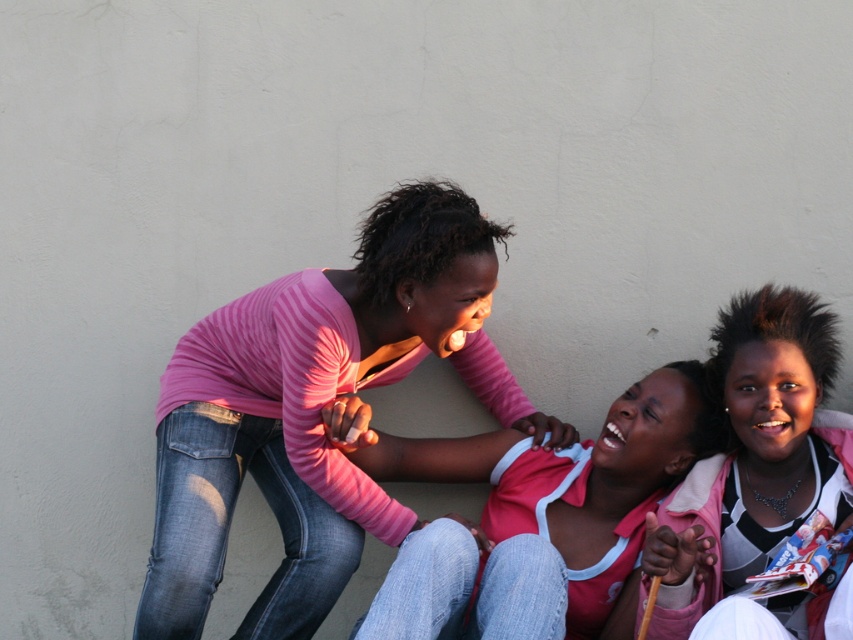
Based on the photo, who is taller, pink striped shirt at center or pink fabric at center?

Standing taller between the two is pink striped shirt at center.

Does point (173, 353) come behind point (775, 547)?

Yes.

Where is `pink striped shirt at center`? pink striped shirt at center is located at coordinates (315, 410).

This screenshot has width=853, height=640. In order to click on pink matte shirt at center in this screenshot , I will do `click(540, 520)`.

What do you see at coordinates (540, 520) in the screenshot? I see `pink matte shirt at center` at bounding box center [540, 520].

Identify the location of pink matte shirt at center. (540, 520).

The height and width of the screenshot is (640, 853). I want to click on pink matte shirt at center, so click(x=540, y=520).

Is point (346, 467) closer to camera compared to point (605, 628)?

No, (346, 467) is behind (605, 628).

Who is higher up, pink striped shirt at center or pink matte shirt at center?

pink striped shirt at center is higher up.

Is point (505, 236) positioned after point (496, 573)?

That is True.

Image resolution: width=853 pixels, height=640 pixels. In order to click on pink striped shirt at center in this screenshot , I will do `click(315, 410)`.